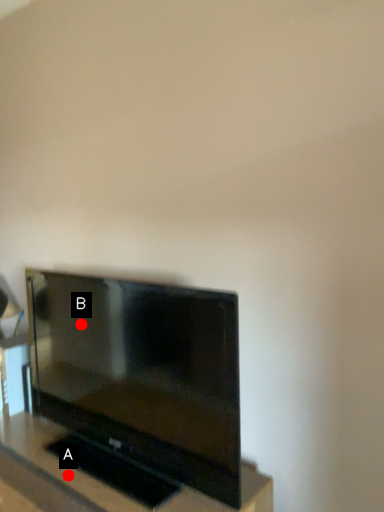
Question: Two points are circled on the image, labeled by A and B beside each circle. Which point appears farthest from the camera in this image?

Choices:
 (A) A is further
 (B) B is further

Answer: (B)